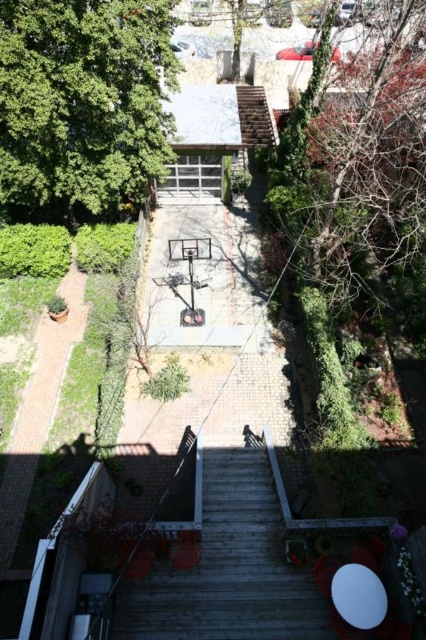
Is bare branches at upper right positioned in front of wooden stairs at center?

No, it is not.

Locate an element on the screen. Image resolution: width=426 pixels, height=640 pixels. bare branches at upper right is located at coordinates pos(356,161).

Consider the image. Can you confirm if green leafy tree at upper left is bigger than bare branches at upper right?

No.

Which is more to the right, green leafy tree at upper left or bare branches at upper right?

Positioned to the right is bare branches at upper right.

Locate an element on the screen. This screenshot has height=640, width=426. green leafy tree at upper left is located at coordinates (83, 104).

Is green leafy tree at upper left wider than wooden stairs at center?

Yes, green leafy tree at upper left is wider than wooden stairs at center.

Between point (31, 141) and point (293, 582), which one is positioned in front?

Point (293, 582)

Between point (140, 113) and point (265, 531), which one is positioned behind?

Point (140, 113)

At what (x,y) coordinates should I click in order to perform the action: click on green leafy tree at upper left. Please return your answer as a coordinate pair (x, y). This screenshot has height=640, width=426. Looking at the image, I should click on (83, 104).